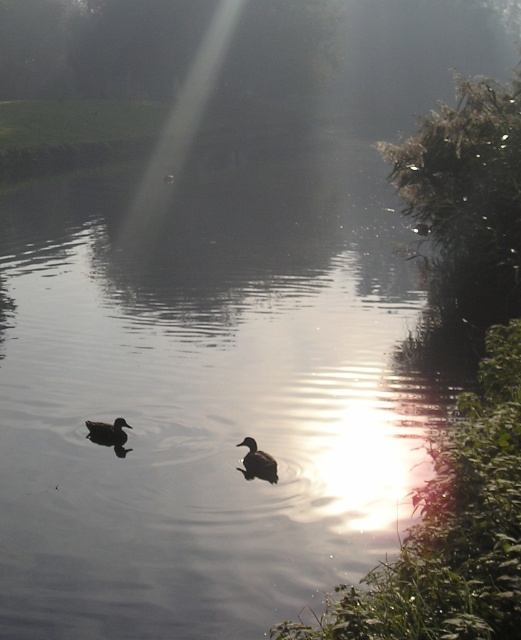
Between smooth dark water at center and dark brown duck at lower left, which one has less height?

dark brown duck at lower left is shorter.

This screenshot has width=521, height=640. What do you see at coordinates (205, 394) in the screenshot?
I see `smooth dark water at center` at bounding box center [205, 394].

What are the coordinates of `smooth dark water at center` in the screenshot? It's located at (205, 394).

The image size is (521, 640). In order to click on smooth dark water at center in this screenshot , I will do `click(205, 394)`.

From the picture: Can you confirm if brown matte duck at center is wider than dark brown duck at lower left?

In fact, brown matte duck at center might be narrower than dark brown duck at lower left.

Does brown matte duck at center have a smaller size compared to dark brown duck at lower left?

No, brown matte duck at center is not smaller than dark brown duck at lower left.

Between point (269, 464) and point (92, 433), which one is positioned in front?

Point (269, 464) is more forward.

You are a GUI agent. You are given a task and a screenshot of the screen. Output one action in this format:
    pyautogui.click(x=<x>, y=<y>)
    Task: Click on the brown matte duck at center
    This screenshot has width=521, height=640.
    Given the screenshot: What is the action you would take?
    pyautogui.click(x=257, y=460)

Can you confirm if smooth dark water at center is positioned below brown matte duck at center?

Incorrect, smooth dark water at center is not positioned below brown matte duck at center.

Does smooth dark water at center have a lesser width compared to brown matte duck at center?

Incorrect, smooth dark water at center's width is not less than brown matte duck at center's.

This screenshot has height=640, width=521. In order to click on smooth dark water at center in this screenshot , I will do `click(205, 394)`.

The height and width of the screenshot is (640, 521). Find the location of `smooth dark water at center`. smooth dark water at center is located at coordinates (205, 394).